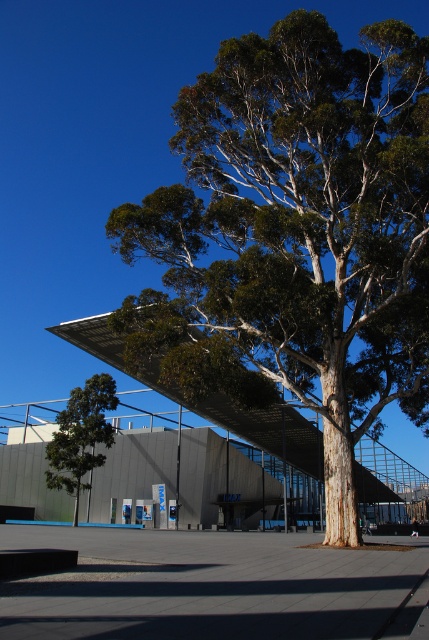
Is point (365, 230) positioned in front of point (105, 444)?

Yes.

Does green leafy tree at center appear on the right side of green leafy tree at left?

Yes, green leafy tree at center is to the right of green leafy tree at left.

Which is behind, point (271, 58) or point (72, 410)?

Positioned behind is point (72, 410).

What are the coordinates of `green leafy tree at center` in the screenshot? It's located at (295, 234).